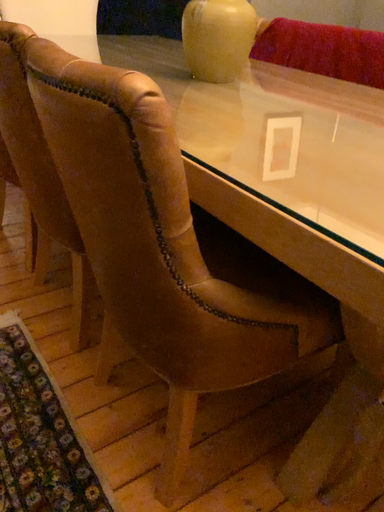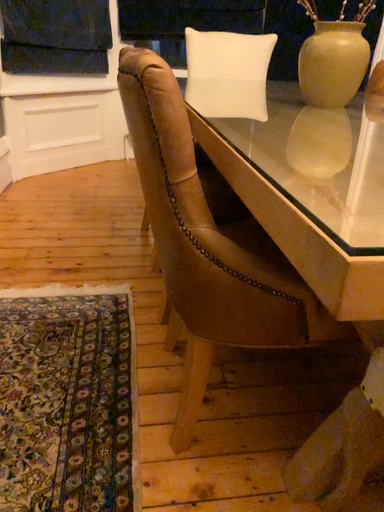
Question: Which way did the camera rotate in the video?

Choices:
 (A) rotated left
 (B) rotated right

Answer: (A)